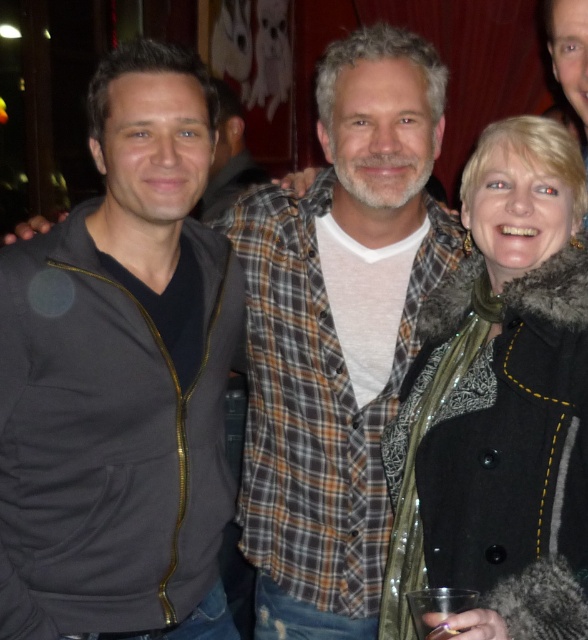
You are standing in front of the group photo and want to know which of the two points, the point at coordinate point (116, 176) or the point at coordinate point (547, 230), is closer to you. Can you determine this based on their positions in the image?

The point at coordinate point (116, 176) is closer to you than the point at coordinate point (547, 230) because it is further to the viewer in the image.